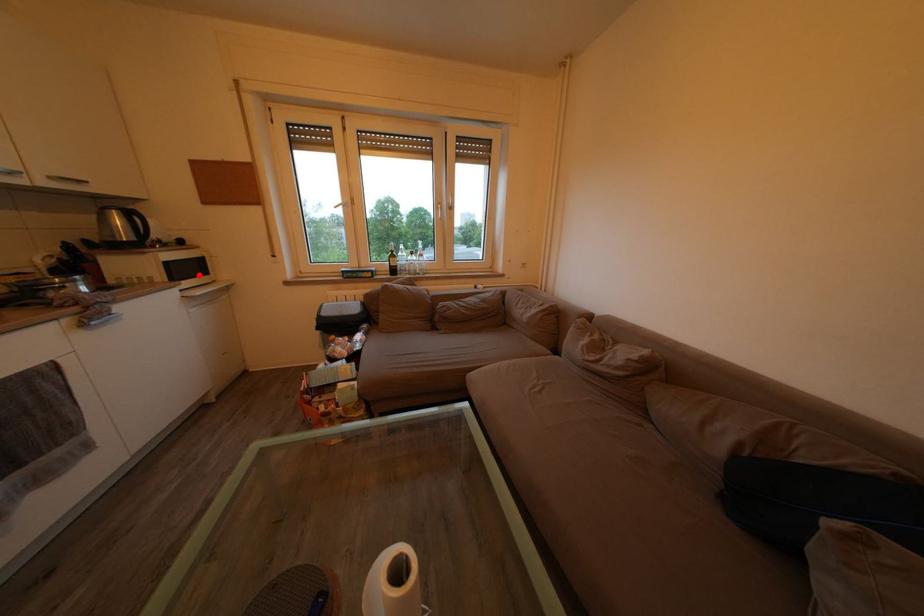
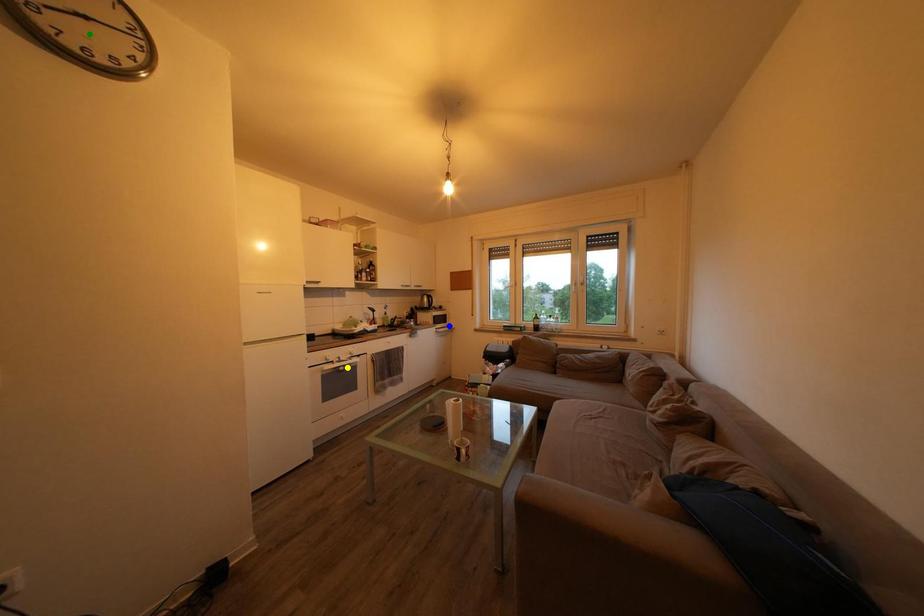
Question: I am providing you with two images of the same scene from different viewpoints. A red point is marked on the first image. You are given multiple points on the second image. Which mark in image 2 goes with the point in image 1?

Choices:
 (A) yellow point
 (B) blue point
 (C) green point

Answer: (B)